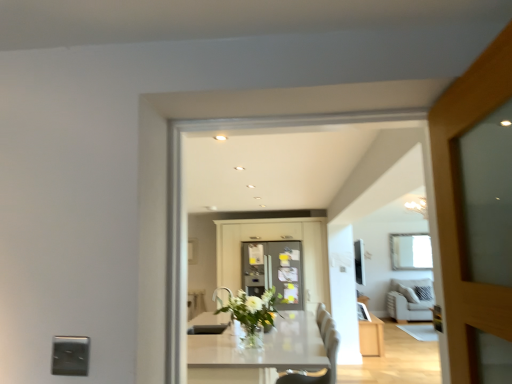
Question: Which direction should I rotate to look at matte gray refrigerator at center, the second cabinetry from the right?

Choices:
 (A) right
 (B) left

Answer: (A)

Question: From the image's perspective, would you say satin silver outlet at lower left is shown under matte white cabinet at lower right, which appears as the 2th cabinetry when viewed from the left?

Choices:
 (A) no
 (B) yes

Answer: (A)

Question: Considering the relative sizes of satin silver outlet at lower left and matte white cabinet at lower right, which appears as the 2th cabinetry when viewed from the left, in the image provided, is satin silver outlet at lower left smaller than matte white cabinet at lower right, which appears as the 2th cabinetry when viewed from the left,?

Choices:
 (A) no
 (B) yes

Answer: (B)

Question: Is satin silver outlet at lower left located outside matte white cabinet at lower right, the first cabinetry in the right-to-left sequence?

Choices:
 (A) no
 (B) yes

Answer: (B)

Question: From the image's perspective, is satin silver outlet at lower left above matte white cabinet at lower right, which appears as the 2th cabinetry when viewed from the left?

Choices:
 (A) yes
 (B) no

Answer: (A)

Question: Considering the relative sizes of satin silver outlet at lower left and matte white cabinet at lower right, which appears as the 2th cabinetry when viewed from the left, in the image provided, is satin silver outlet at lower left thinner than matte white cabinet at lower right, which appears as the 2th cabinetry when viewed from the left,?

Choices:
 (A) no
 (B) yes

Answer: (B)

Question: From a real-world perspective, does satin silver outlet at lower left stand above matte white cabinet at lower right, which appears as the 2th cabinetry when viewed from the left?

Choices:
 (A) no
 (B) yes

Answer: (B)

Question: Is white glass vase at center to the left of satin silver outlet at lower left from the viewer's perspective?

Choices:
 (A) no
 (B) yes

Answer: (A)

Question: Is white glass vase at center next to satin silver outlet at lower left?

Choices:
 (A) yes
 (B) no

Answer: (B)

Question: Could you tell me if white glass vase at center is facing satin silver outlet at lower left?

Choices:
 (A) yes
 (B) no

Answer: (B)

Question: From a real-world perspective, is white glass vase at center below satin silver outlet at lower left?

Choices:
 (A) no
 (B) yes

Answer: (B)

Question: Does white glass vase at center have a greater width compared to satin silver outlet at lower left?

Choices:
 (A) no
 (B) yes

Answer: (B)

Question: Does white glass vase at center have a smaller size compared to satin silver outlet at lower left?

Choices:
 (A) yes
 (B) no

Answer: (B)

Question: Could you tell me if satin silver outlet at lower left is turned towards white glossy table at center?

Choices:
 (A) yes
 (B) no

Answer: (B)